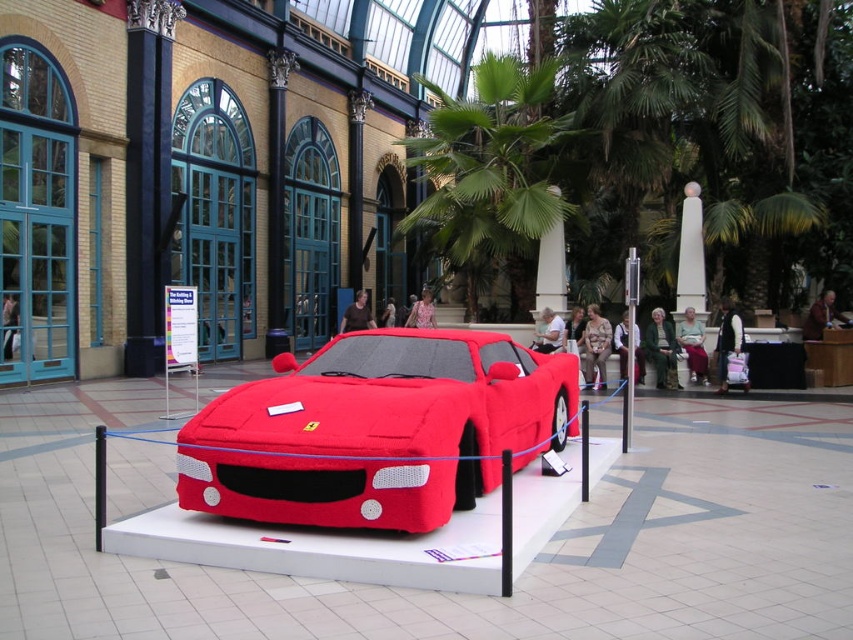
Which is more to the left, matte fabric sports car at center or green leafy palm tree at upper center?

From the viewer's perspective, green leafy palm tree at upper center appears more on the left side.

Consider the image. Who is more forward, (311, 432) or (486, 257)?

Point (311, 432) is in front.

Is point (241, 472) farther from camera compared to point (505, 77)?

No, it is in front of (505, 77).

In order to click on matte fabric sports car at center in this screenshot , I will do `click(376, 429)`.